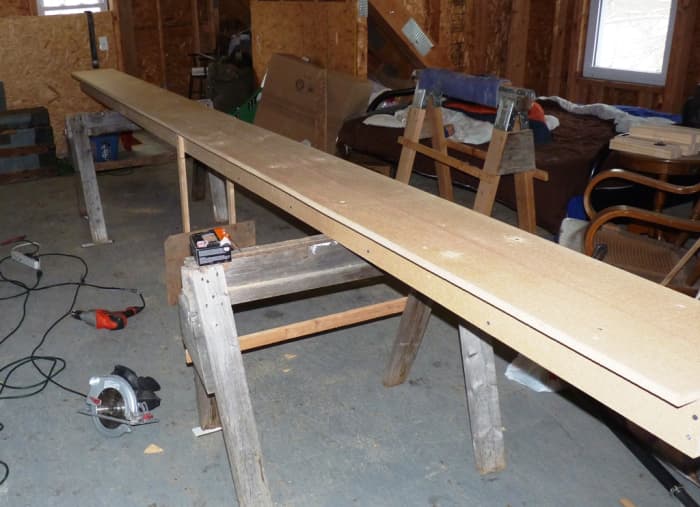
At what (x,y) coordinates should I click in order to perform the action: click on table. Please return your answer as a coordinate pair (x, y). The image size is (700, 507). Looking at the image, I should click on (629, 173).